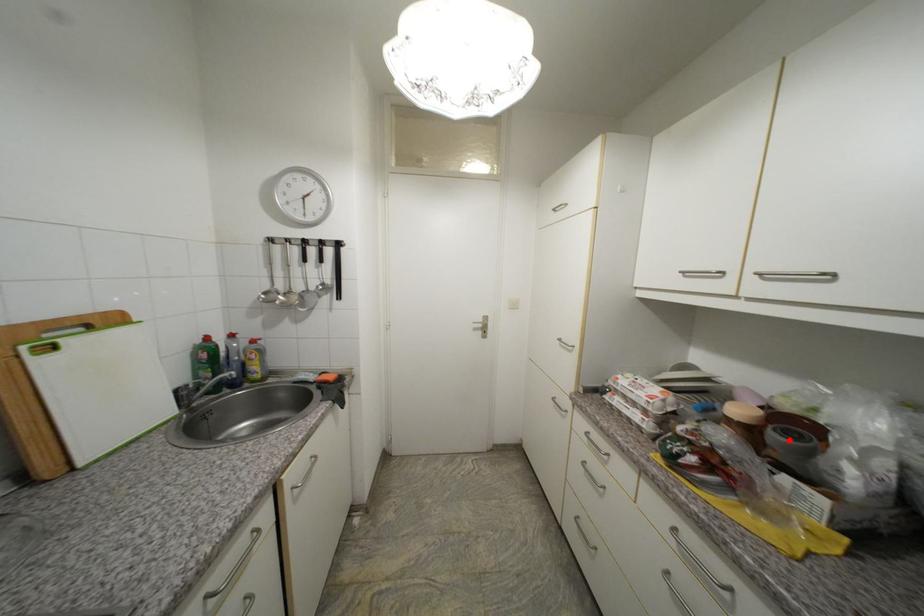
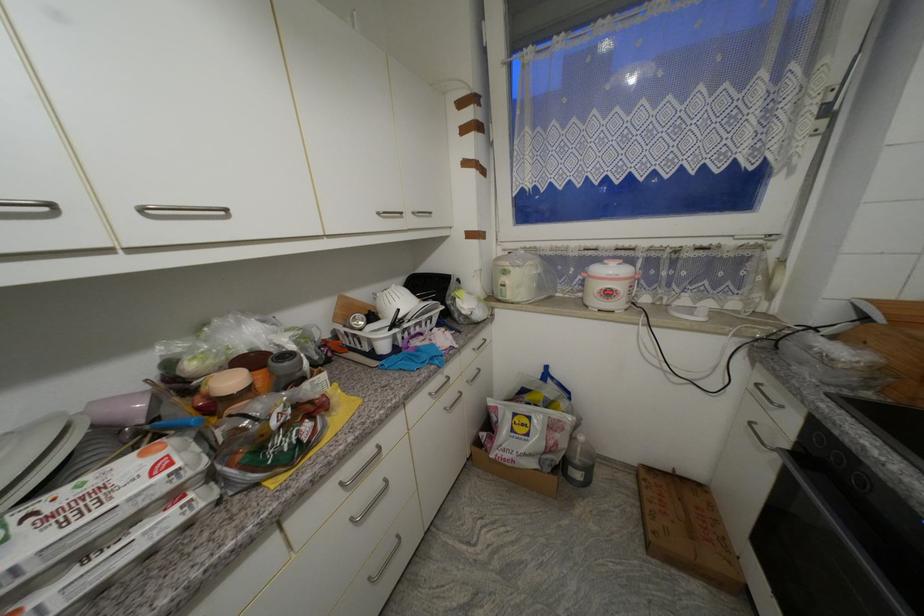
In the second image, find the point that corresponds to the highlighted location in the first image.

(292, 365)